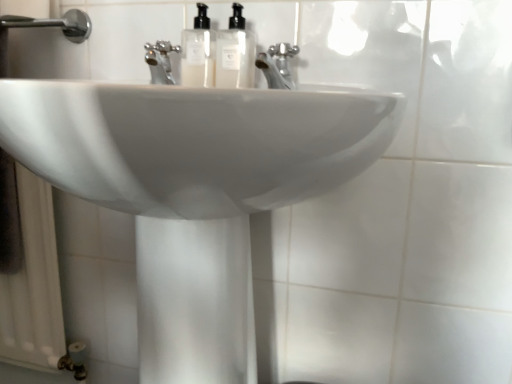
Question: Does translucent plastic soap dispenser at center, placed as the 1th soap dispenser when sorted from right to left, have a greater width compared to chrome metallic faucet at center?

Choices:
 (A) yes
 (B) no

Answer: (B)

Question: From the image's perspective, is translucent plastic soap dispenser at center, the second soap dispenser viewed from the left, below chrome metallic faucet at center?

Choices:
 (A) no
 (B) yes

Answer: (A)

Question: Does translucent plastic soap dispenser at center, placed as the 1th soap dispenser when sorted from right to left, have a smaller size compared to chrome metallic faucet at center?

Choices:
 (A) yes
 (B) no

Answer: (A)

Question: Does translucent plastic soap dispenser at center, placed as the 1th soap dispenser when sorted from right to left, have a lesser width compared to chrome metallic faucet at center?

Choices:
 (A) no
 (B) yes

Answer: (B)

Question: From a real-world perspective, is translucent plastic soap dispenser at center, the second soap dispenser viewed from the left, located higher than chrome metallic faucet at center?

Choices:
 (A) yes
 (B) no

Answer: (A)

Question: Does translucent plastic soap dispenser at center, placed as the 1th soap dispenser when sorted from right to left, touch chrome metallic faucet at center?

Choices:
 (A) no
 (B) yes

Answer: (B)

Question: Does chrome metallic faucet at center appear on the left side of white glossy sink at center?

Choices:
 (A) no
 (B) yes

Answer: (A)

Question: Considering the relative sizes of chrome metallic faucet at center and white glossy sink at center in the image provided, is chrome metallic faucet at center bigger than white glossy sink at center?

Choices:
 (A) yes
 (B) no

Answer: (B)

Question: From a real-world perspective, does chrome metallic faucet at center stand above white glossy sink at center?

Choices:
 (A) yes
 (B) no

Answer: (A)

Question: Is chrome metallic faucet at center taller than white glossy sink at center?

Choices:
 (A) yes
 (B) no

Answer: (B)

Question: Can you confirm if chrome metallic faucet at center is smaller than white glossy sink at center?

Choices:
 (A) yes
 (B) no

Answer: (A)

Question: Can you confirm if chrome metallic faucet at center is positioned to the right of white glossy sink at center?

Choices:
 (A) yes
 (B) no

Answer: (A)

Question: Considering the relative sizes of chrome metallic faucet at center and translucent plastic soap dispenser at center, placed as the 1th soap dispenser when sorted from right to left, in the image provided, is chrome metallic faucet at center taller than translucent plastic soap dispenser at center, placed as the 1th soap dispenser when sorted from right to left,?

Choices:
 (A) no
 (B) yes

Answer: (A)